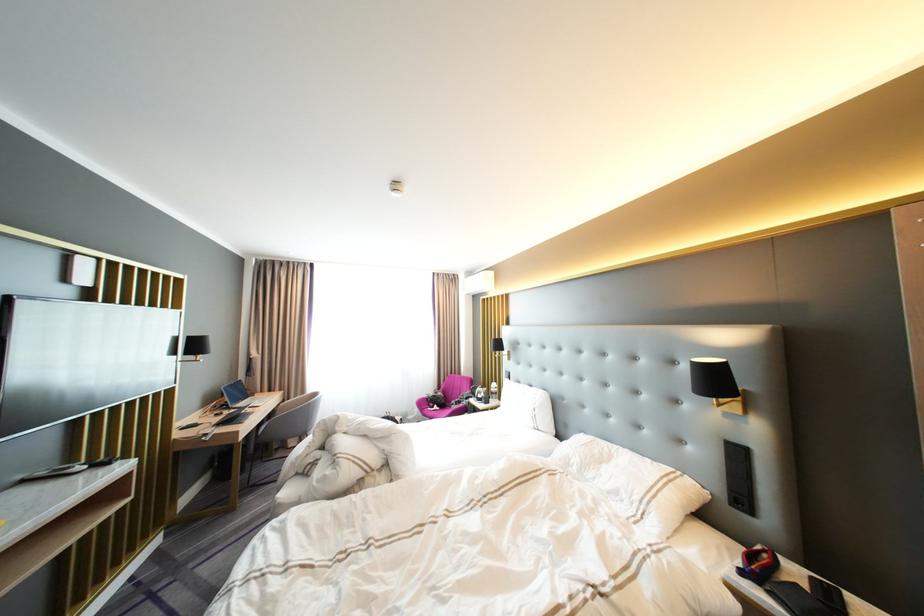
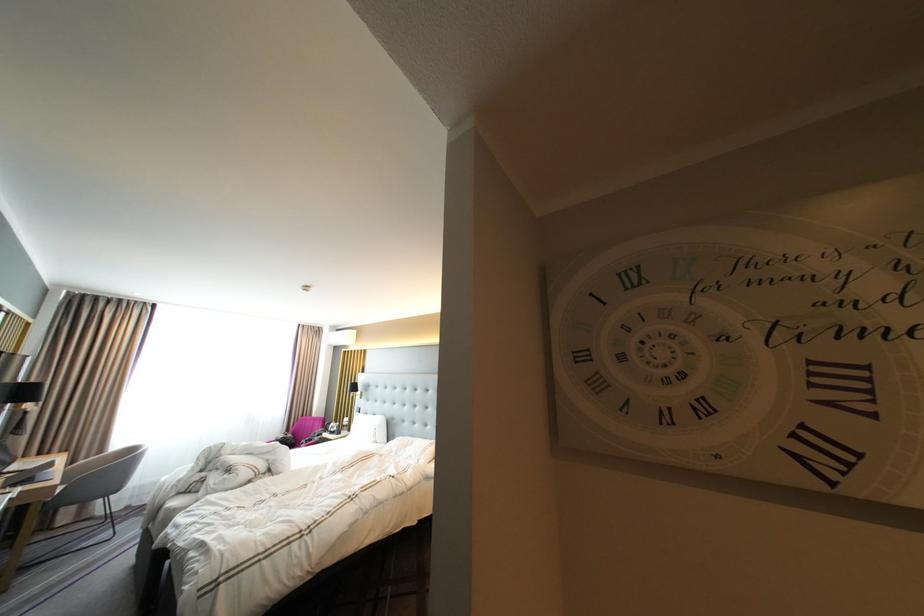
The point at (253, 405) is marked in the first image. Where is the corresponding point in the second image?

(27, 468)